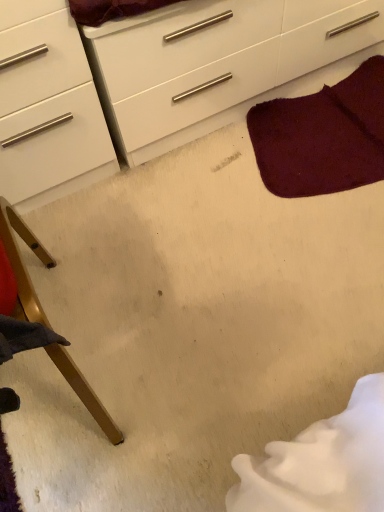
At what (x,y) coordinates should I click in order to perform the action: click on burgundy plush rug at upper right. Please return your answer as a coordinate pair (x, y). Looking at the image, I should click on (323, 136).

You are a GUI agent. You are given a task and a screenshot of the screen. Output one action in this format:
    pyautogui.click(x=<x>, y=<y>)
    Task: Click on the white glossy chest of drawers at upper center
    
    Given the screenshot: What is the action you would take?
    pyautogui.click(x=152, y=78)

Identify the location of wooden chair leg at lower left. (23, 264).

Would you say wooden chair leg at lower left is to the left or to the right of white glossy chest of drawers at upper center in the picture?

In the image, wooden chair leg at lower left appears on the left side of white glossy chest of drawers at upper center.

From a real-world perspective, is wooden chair leg at lower left physically below white glossy chest of drawers at upper center?

No, from a real-world perspective, wooden chair leg at lower left is not beneath white glossy chest of drawers at upper center.

Which object is more forward, wooden chair leg at lower left or white glossy chest of drawers at upper center?

wooden chair leg at lower left is in front.

Which of these two, wooden chair leg at lower left or white glossy chest of drawers at upper center, is bigger?

Bigger between the two is white glossy chest of drawers at upper center.

From the picture: Who is smaller, burgundy plush rug at upper right or white glossy chest of drawers at upper center?

Smaller between the two is burgundy plush rug at upper right.

Considering the sizes of burgundy plush rug at upper right and white glossy chest of drawers at upper center in the image, is burgundy plush rug at upper right wider or thinner than white glossy chest of drawers at upper center?

burgundy plush rug at upper right is thinner than white glossy chest of drawers at upper center.

Is white glossy chest of drawers at upper center at the back of burgundy plush rug at upper right?

Yes, white glossy chest of drawers at upper center is at the back of burgundy plush rug at upper right.

Is white glossy chest of drawers at upper center behind wooden chair leg at lower left?

Yes.

Can you confirm if white glossy chest of drawers at upper center is wider than wooden chair leg at lower left?

In fact, white glossy chest of drawers at upper center might be narrower than wooden chair leg at lower left.

Find the location of a particular element. the chest of drawers beneath the wooden chair leg at lower left (from a real-world perspective) is located at coordinates (152, 78).

In the image, is white glossy chest of drawers at upper center on the left side or the right side of wooden chair leg at lower left?

white glossy chest of drawers at upper center is to the right of wooden chair leg at lower left.

Considering the relative sizes of white glossy chest of drawers at upper center and burgundy plush rug at upper right in the image provided, is white glossy chest of drawers at upper center shorter than burgundy plush rug at upper right?

No.

Which is behind, point (151, 108) or point (284, 160)?

The point (284, 160) is more distant.

Identify the location of the chest of drawers lying in front of the burgundy plush rug at upper right. (152, 78).

Which object is more forward, white glossy chest of drawers at upper center or burgundy plush rug at upper right?

white glossy chest of drawers at upper center is closer to the camera.

From a real-world perspective, is burgundy plush rug at upper right physically above wooden chair leg at lower left?

Incorrect, from a real-world perspective, burgundy plush rug at upper right is lower than wooden chair leg at lower left.

Considering the sizes of objects burgundy plush rug at upper right and wooden chair leg at lower left in the image provided, who is thinner, burgundy plush rug at upper right or wooden chair leg at lower left?

burgundy plush rug at upper right.

In the image, is burgundy plush rug at upper right positioned in front of or behind wooden chair leg at lower left?

Visually, burgundy plush rug at upper right is located behind wooden chair leg at lower left.

Is burgundy plush rug at upper right shorter than wooden chair leg at lower left?

Indeed, burgundy plush rug at upper right has a lesser height compared to wooden chair leg at lower left.

Considering the relative sizes of wooden chair leg at lower left and burgundy plush rug at upper right in the image provided, is wooden chair leg at lower left taller than burgundy plush rug at upper right?

Correct, wooden chair leg at lower left is much taller as burgundy plush rug at upper right.

Is wooden chair leg at lower left closer to camera compared to burgundy plush rug at upper right?

Yes, wooden chair leg at lower left is in front of burgundy plush rug at upper right.

Is wooden chair leg at lower left oriented towards burgundy plush rug at upper right?

No, wooden chair leg at lower left does not turn towards burgundy plush rug at upper right.

Where is `chest of drawers on the right of the wooden chair leg at lower left`? chest of drawers on the right of the wooden chair leg at lower left is located at coordinates (152, 78).

Find the location of a particular element. The height and width of the screenshot is (512, 384). blanket that is behind the white glossy chest of drawers at upper center is located at coordinates (323, 136).

When comparing their distances from burgundy plush rug at upper right, does white glossy chest of drawers at upper center or wooden chair leg at lower left seem closer?

white glossy chest of drawers at upper center is positioned closer to the anchor burgundy plush rug at upper right.

Considering their positions, is white glossy chest of drawers at upper center positioned closer to wooden chair leg at lower left than burgundy plush rug at upper right?

white glossy chest of drawers at upper center lies closer to wooden chair leg at lower left than the other object.

Considering their positions, is wooden chair leg at lower left positioned closer to white glossy chest of drawers at upper center than burgundy plush rug at upper right?

Based on the image, burgundy plush rug at upper right appears to be nearer to white glossy chest of drawers at upper center.

From the image, which object appears to be nearer to white glossy chest of drawers at upper center, burgundy plush rug at upper right or wooden chair leg at lower left?

burgundy plush rug at upper right.

Based on their spatial positions, is burgundy plush rug at upper right or white glossy chest of drawers at upper center closer to wooden chair leg at lower left?

white glossy chest of drawers at upper center is positioned closer to the anchor wooden chair leg at lower left.

Estimate the real-world distances between objects in this image. Which object is further from burgundy plush rug at upper right, wooden chair leg at lower left or white glossy chest of drawers at upper center?

Based on the image, wooden chair leg at lower left appears to be further to burgundy plush rug at upper right.

Find the location of a particular element. Image resolution: width=384 pixels, height=512 pixels. chest of drawers between wooden chair leg at lower left and burgundy plush rug at upper right from left to right is located at coordinates (152, 78).